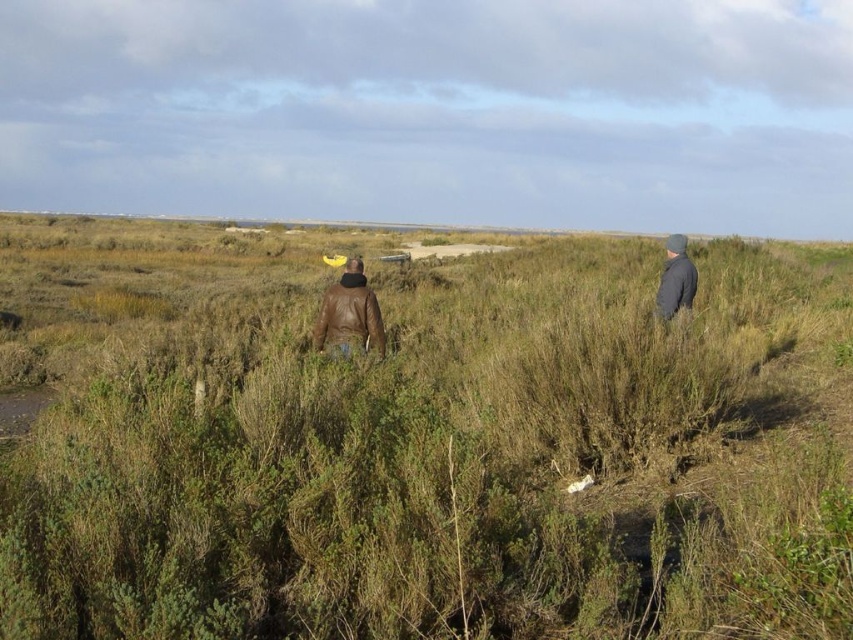
Question: Does green grassy at center have a lesser width compared to gray woolen hat at right?

Choices:
 (A) yes
 (B) no

Answer: (B)

Question: Among these points, which one is farthest from the camera?

Choices:
 (A) (180, 522)
 (B) (657, 316)

Answer: (B)

Question: Can you confirm if brown leather jacket at center is positioned to the left of gray woolen hat at right?

Choices:
 (A) yes
 (B) no

Answer: (A)

Question: Is brown leather jacket at center further to camera compared to gray woolen hat at right?

Choices:
 (A) no
 (B) yes

Answer: (A)

Question: Which object is the farthest from the green grassy at center?

Choices:
 (A) gray woolen hat at right
 (B) brown leather jacket at center

Answer: (A)

Question: Which object is the closest to the gray woolen hat at right?

Choices:
 (A) green grassy at center
 (B) brown leather jacket at center

Answer: (B)